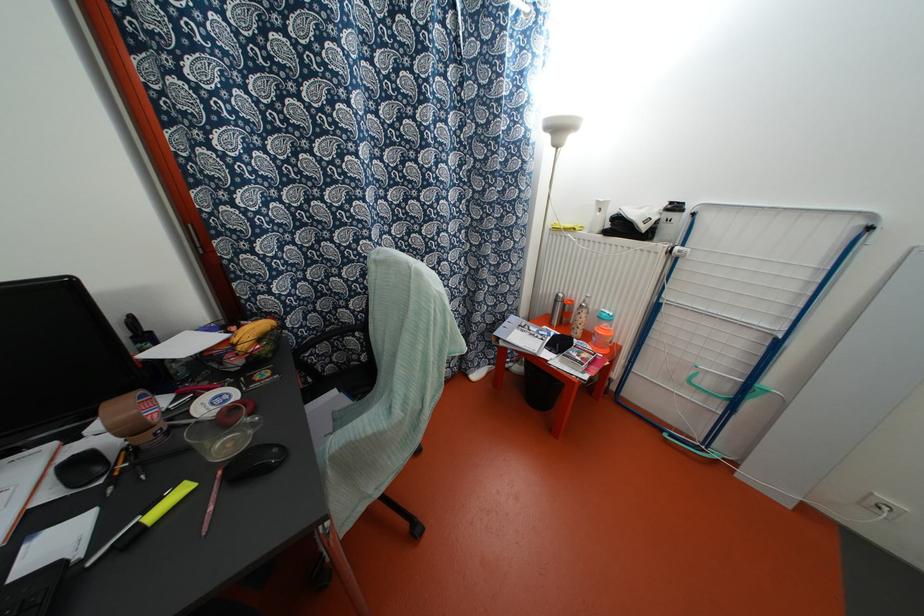
The height and width of the screenshot is (616, 924). I want to click on white power socket, so click(x=881, y=506).